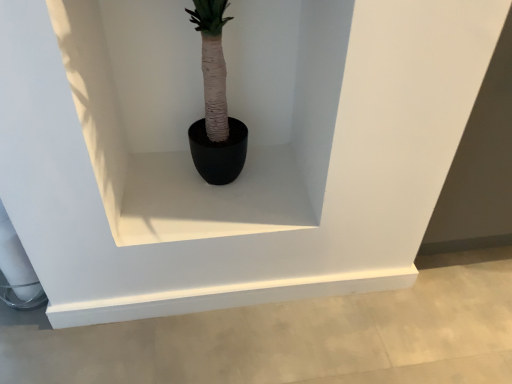
The width and height of the screenshot is (512, 384). I want to click on black matte pot at center, so click(203, 111).

The height and width of the screenshot is (384, 512). Describe the element at coordinates (203, 111) in the screenshot. I see `black matte pot at center` at that location.

What is the approximate width of black matte pot at center?

black matte pot at center is 41.42 centimeters in width.

What do you see at coordinates (212, 198) in the screenshot? The width and height of the screenshot is (512, 384). I see `white matte window sill at center` at bounding box center [212, 198].

Locate an element on the screen. The width and height of the screenshot is (512, 384). white matte window sill at center is located at coordinates (212, 198).

You are a GUI agent. You are given a task and a screenshot of the screen. Output one action in this format:
    pyautogui.click(x=<x>, y=<y>)
    Task: Click on the black matte pot at center
    Image resolution: width=512 pixels, height=384 pixels.
    Given the screenshot: What is the action you would take?
    pyautogui.click(x=203, y=111)

In the image, is black matte pot at center on the left side or the right side of white matte window sill at center?

black matte pot at center is positioned on white matte window sill at center's right side.

Is black matte pot at center closer to camera compared to white matte window sill at center?

Yes, black matte pot at center is in front of white matte window sill at center.

Considering the positions of points (244, 39) and (230, 231), is point (244, 39) farther from camera compared to point (230, 231)?

Yes.

From the image's perspective, who appears lower, black matte pot at center or white matte window sill at center?

From the image's view, white matte window sill at center is below.

From a real-world perspective, relative to white matte window sill at center, is black matte pot at center vertically above or below?

Clearly, from a real-world perspective, black matte pot at center is above white matte window sill at center.

Based on the photo, considering the relative sizes of black matte pot at center and white matte window sill at center in the image provided, is black matte pot at center wider than white matte window sill at center?

Incorrect, the width of black matte pot at center does not surpass that of white matte window sill at center.

Between black matte pot at center and white matte window sill at center, which one has less height?

With less height is white matte window sill at center.

Which of these two, black matte pot at center or white matte window sill at center, is bigger?

black matte pot at center is bigger.

Is black matte pot at center inside or outside of white matte window sill at center?

black matte pot at center is outside white matte window sill at center.

Would you say black matte pot at center is a long distance from white matte window sill at center?

No, there isn't a large distance between black matte pot at center and white matte window sill at center.

Is black matte pot at center positioned with its back to white matte window sill at center?

No, black matte pot at center is not facing away from white matte window sill at center.

You are a GUI agent. You are given a task and a screenshot of the screen. Output one action in this format:
    pyautogui.click(x=<x>, y=<y>)
    Task: Click on the shelf above the white matte window sill at center (from a real-world perspective)
    The width and height of the screenshot is (512, 384).
    Given the screenshot: What is the action you would take?
    pyautogui.click(x=203, y=111)

Is white matte window sill at center at the right side of black matte pot at center?

Incorrect, white matte window sill at center is not on the right side of black matte pot at center.

In the image, is white matte window sill at center positioned in front of or behind black matte pot at center?

Clearly, white matte window sill at center is behind black matte pot at center.

Considering the points (268, 190) and (335, 83), which point is in front, point (268, 190) or point (335, 83)?

Point (335, 83)

From the image's perspective, which one is positioned higher, white matte window sill at center or black matte pot at center?

black matte pot at center.

From a real-world perspective, is white matte window sill at center below black matte pot at center?

Indeed, from a real-world perspective, white matte window sill at center is positioned beneath black matte pot at center.

Between white matte window sill at center and black matte pot at center, which one has smaller width?

black matte pot at center is thinner.

Is white matte window sill at center shorter than black matte pot at center?

Yes.

Considering the sizes of objects white matte window sill at center and black matte pot at center in the image provided, who is bigger, white matte window sill at center or black matte pot at center?

black matte pot at center is bigger.

Could black matte pot at center be considered to be inside white matte window sill at center?

No.

Are white matte window sill at center and black matte pot at center far apart?

white matte window sill at center is near black matte pot at center, not far away.

Could you tell me if white matte window sill at center is facing black matte pot at center?

No.

Where is `shelf in front of the white matte window sill at center`? This screenshot has height=384, width=512. shelf in front of the white matte window sill at center is located at coordinates (203, 111).

Find the location of `window sill on the left side of black matte pot at center`. window sill on the left side of black matte pot at center is located at coordinates (212, 198).

In order to click on shelf above the white matte window sill at center (from a real-world perspective) in this screenshot , I will do `click(203, 111)`.